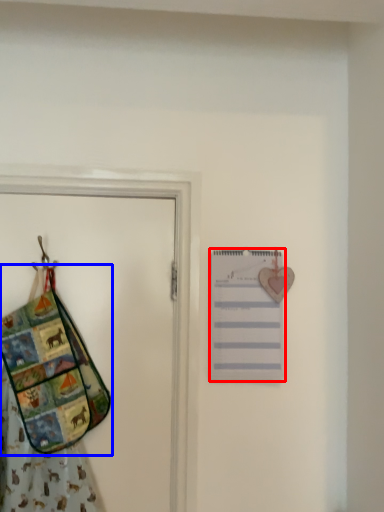
Question: Which point is closer to the camera, list (highlighted by a red box) or handbag (highlighted by a blue box)?

Choices:
 (A) list
 (B) handbag

Answer: (B)